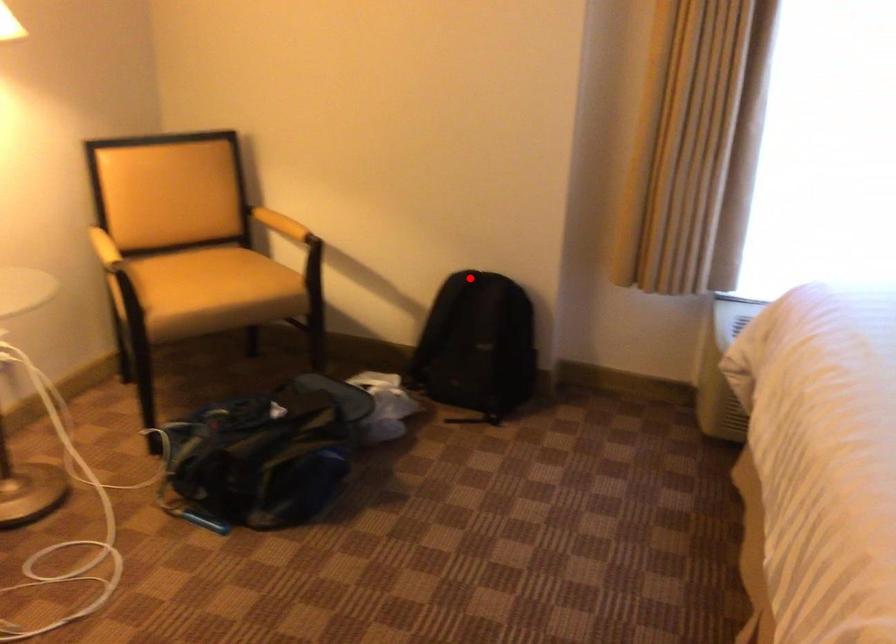
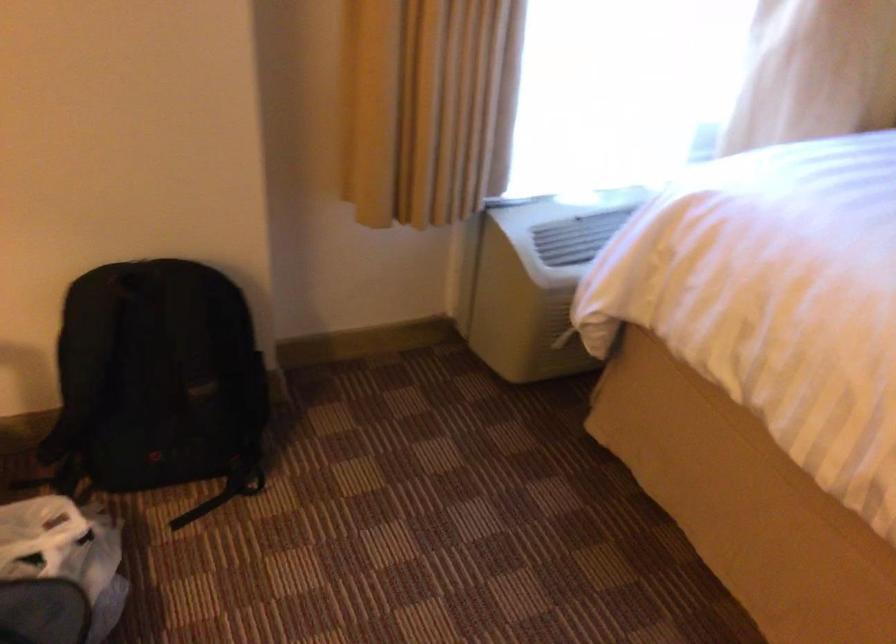
The point at the highlighted location is marked in the first image. Where is the corresponding point in the second image?

(135, 281)